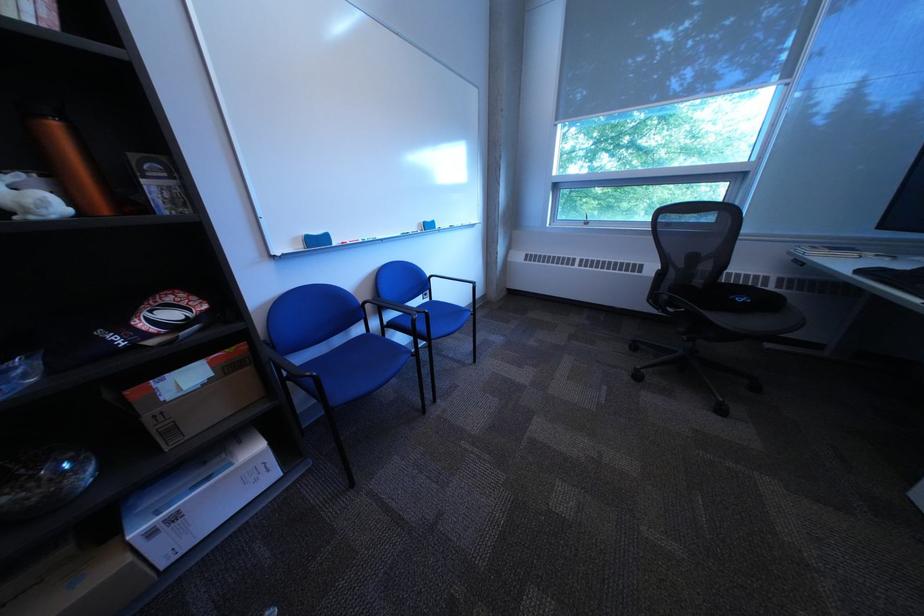
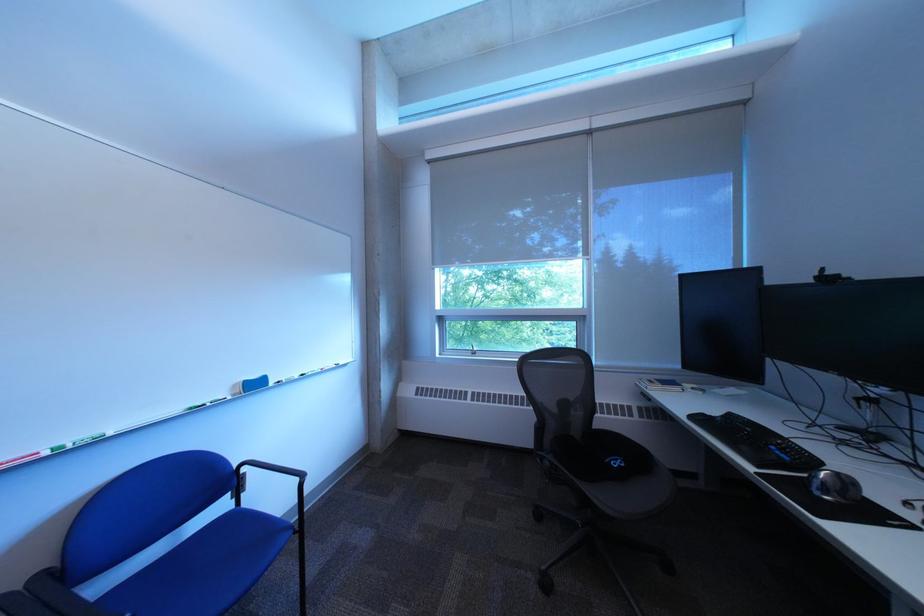
Where in the second image is the point corresponding to the point at 444,302 from the first image?

(248, 508)